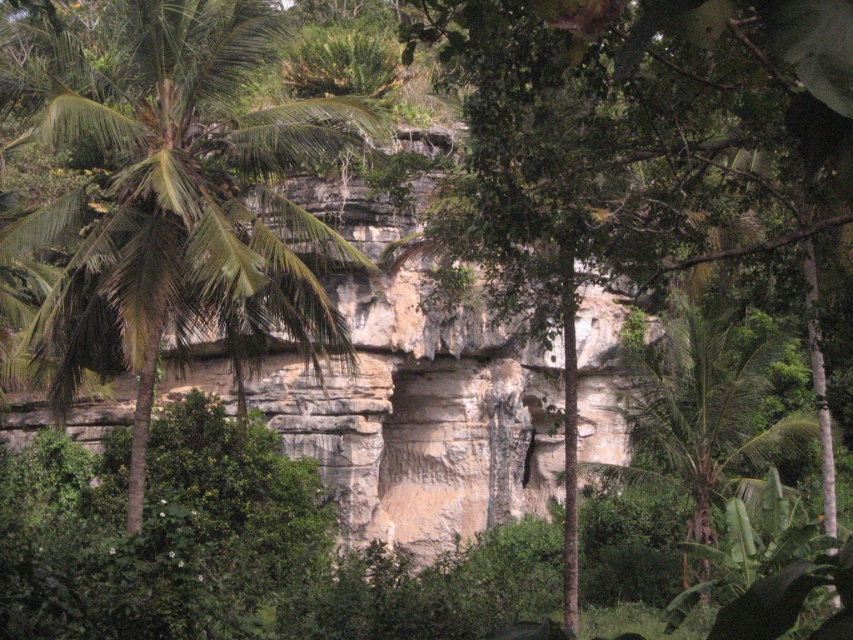
Does green leafy palm tree at left have a greater height compared to green leafy palm tree at center?

Indeed, green leafy palm tree at left has a greater height compared to green leafy palm tree at center.

Is green leafy palm tree at left to the right of green leafy palm tree at center from the viewer's perspective?

In fact, green leafy palm tree at left is to the left of green leafy palm tree at center.

Where is `green leafy palm tree at left`? The width and height of the screenshot is (853, 640). green leafy palm tree at left is located at coordinates [x=173, y=198].